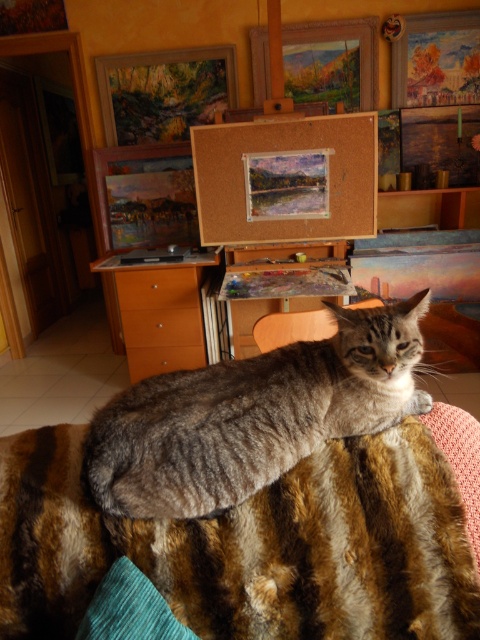
You are an interior designer planning to hang a large mirror above the striped fur blanket at center and the corkboard at center. Based on their heights, which object requires a higher mounting position?

The corkboard at center requires a higher mounting position because it has a greater height than the striped fur blanket at center.

Based on the scene description, where is the striped fur blanket at center located in terms of its 2D coordinates?

The striped fur blanket at center is located at the 2D coordinates of point [251,547].

From the picture: You are an artist who needs to hang a new painting. You see the gray striped fur cat at center and the corkboard at center. Which object is closer to the left side of the room?

The gray striped fur cat at center is closer to the left side of the room because it is positioned to the left of the corkboard at center.